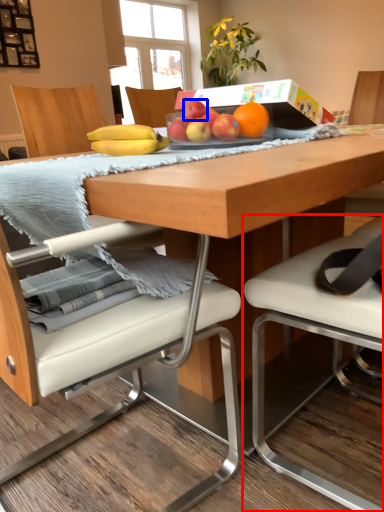
Question: Which of the following is the farthest to the observer, chair (highlighted by a red box) or apple (highlighted by a blue box)?

Choices:
 (A) chair
 (B) apple

Answer: (B)